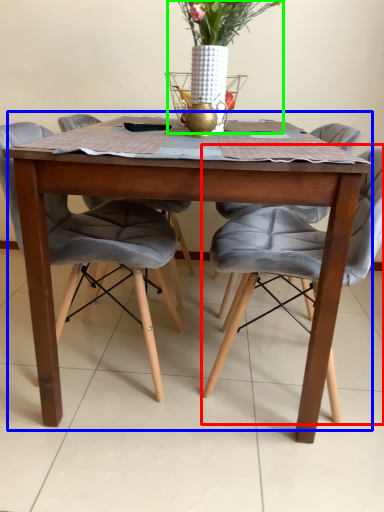
Question: Which object is the closest to the chair (highlighted by a red box)? Choose among these: kitchen & dining room table (highlighted by a blue box) or floral arrangement (highlighted by a green box).

Choices:
 (A) kitchen & dining room table
 (B) floral arrangement

Answer: (A)